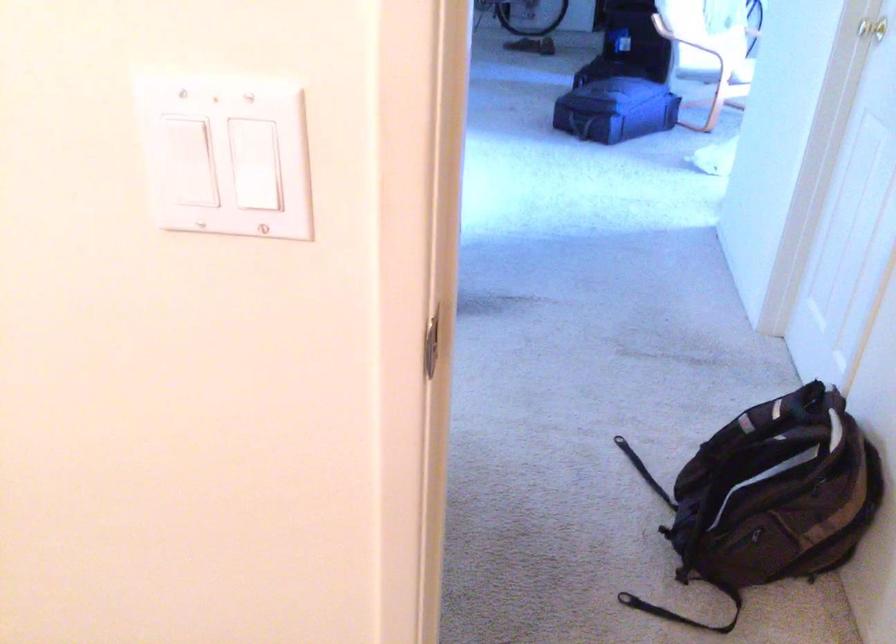
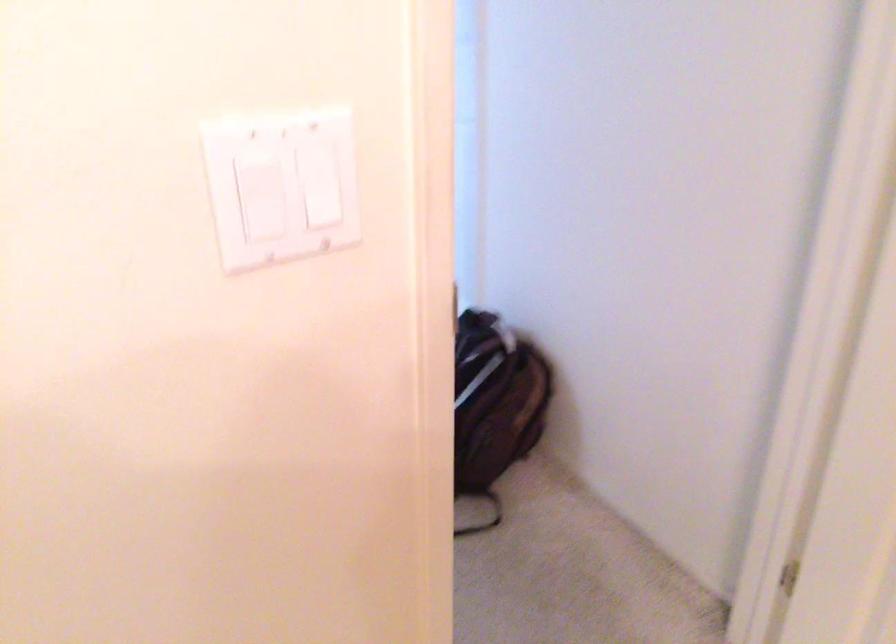
The point at (178, 149) is marked in the first image. Where is the corresponding point in the second image?

(260, 194)